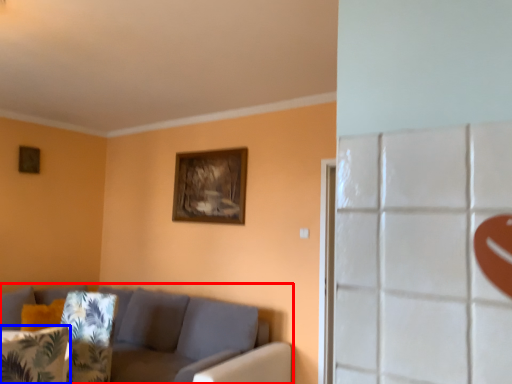
Question: Which point is closer to the camera, studio couch (highlighted by a red box) or pillow (highlighted by a blue box)?

Choices:
 (A) studio couch
 (B) pillow

Answer: (B)